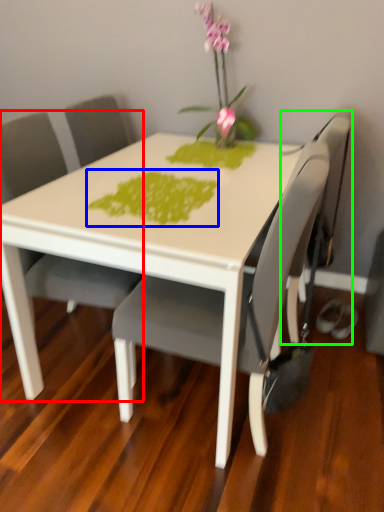
Question: Which object is positioned closest to chair (highlighted by a red box)? Select from design (highlighted by a blue box) and swivel chair (highlighted by a green box).

Choices:
 (A) design
 (B) swivel chair

Answer: (A)